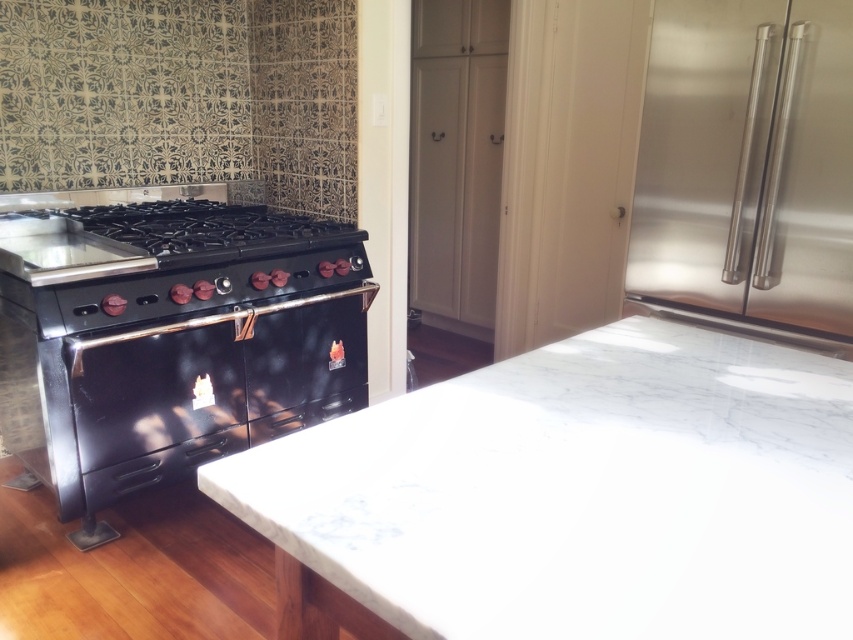
You are a chef preparing a meal and need to place a hot pan on the white marble countertop at center. However, you notice the stainless steel refrigerator at right nearby. Where should you place the pan to avoid it being too close to the refrigerator?

The white marble countertop at center is located below the stainless steel refrigerator at right, so placing the pan on the countertop away from the refrigerator area would keep it at a safe distance.